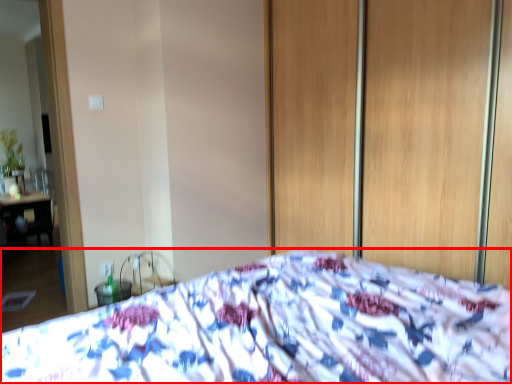
Question: From the image's perspective, considering the relative positions of bed (annotated by the red box) and screen door in the image provided, where is bed (annotated by the red box) located with respect to the staircase?

Choices:
 (A) above
 (B) below

Answer: (B)